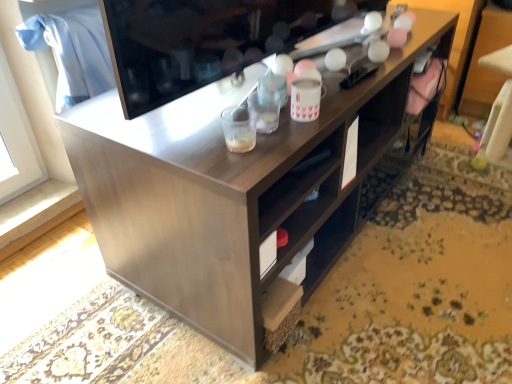
Question: Is the depth of matte black television at upper center greater than that of translucent plastic cup at center, the 2th beverage from the right?

Choices:
 (A) no
 (B) yes

Answer: (A)

Question: From a real-world perspective, is matte black television at upper center positioned over translucent plastic cup at center, which is counted as the 1th beverage, starting from the front, based on gravity?

Choices:
 (A) no
 (B) yes

Answer: (B)

Question: Would you say translucent plastic cup at center, which is counted as the 1th beverage, starting from the front, is part of matte black television at upper center's contents?

Choices:
 (A) no
 (B) yes

Answer: (A)

Question: Can you confirm if matte black television at upper center is wider than translucent plastic cup at center, arranged as the 1th beverage when viewed from the left?

Choices:
 (A) no
 (B) yes

Answer: (B)

Question: From the image's perspective, is matte black television at upper center located above translucent plastic cup at center, which is counted as the 1th beverage, starting from the front?

Choices:
 (A) yes
 (B) no

Answer: (A)

Question: Does point (224, 125) appear closer or farther from the camera than point (315, 109)?

Choices:
 (A) closer
 (B) farther

Answer: (A)

Question: In the image, is translucent plastic cup at center, the second beverage when ordered from back to front, on the left side or the right side of white ceramic mug at upper center, which is the first beverage in right-to-left order?

Choices:
 (A) left
 (B) right

Answer: (A)

Question: From their relative heights in the image, would you say translucent plastic cup at center, arranged as the 1th beverage when viewed from the left, is taller or shorter than white ceramic mug at upper center, which is the first beverage in right-to-left order?

Choices:
 (A) short
 (B) tall

Answer: (A)

Question: From a real-world perspective, is translucent plastic cup at center, arranged as the 1th beverage when viewed from the left, above or below white ceramic mug at upper center, which is the first beverage in right-to-left order?

Choices:
 (A) below
 (B) above

Answer: (A)

Question: In terms of width, does white ceramic mug at upper center, which appears as the second beverage when viewed from the left, look wider or thinner when compared to matte black television at upper center?

Choices:
 (A) thin
 (B) wide

Answer: (A)

Question: From a real-world perspective, is white ceramic mug at upper center, which appears as the second beverage when viewed from the left, positioned above or below matte black television at upper center?

Choices:
 (A) above
 (B) below

Answer: (B)

Question: Is white ceramic mug at upper center, the second beverage positioned from the front, taller or shorter than matte black television at upper center?

Choices:
 (A) tall
 (B) short

Answer: (B)

Question: Considering the positions of white ceramic mug at upper center, which is the first beverage in right-to-left order, and matte black television at upper center in the image, is white ceramic mug at upper center, which is the first beverage in right-to-left order, bigger or smaller than matte black television at upper center?

Choices:
 (A) big
 (B) small

Answer: (B)

Question: Considering the positions of translucent plastic cup at center, the second beverage when ordered from back to front, and matte black television at upper center in the image, is translucent plastic cup at center, the second beverage when ordered from back to front, wider or thinner than matte black television at upper center?

Choices:
 (A) thin
 (B) wide

Answer: (A)

Question: Is translucent plastic cup at center, which is counted as the 1th beverage, starting from the front, to the left or to the right of matte black television at upper center in the image?

Choices:
 (A) left
 (B) right

Answer: (B)